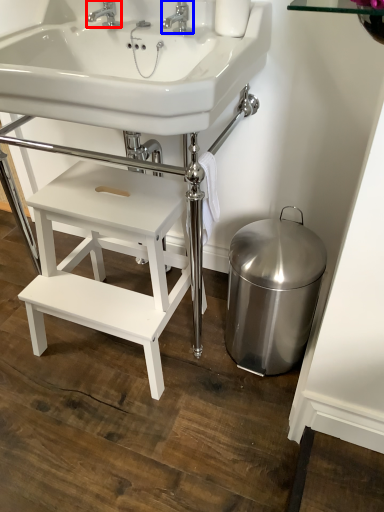
Question: Which point is further to the camera, tap (highlighted by a red box) or tap (highlighted by a blue box)?

Choices:
 (A) tap
 (B) tap

Answer: (A)